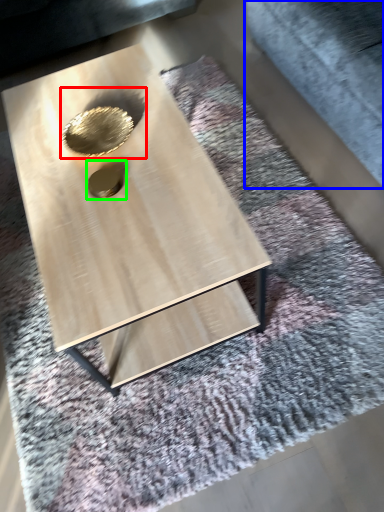
Question: Which object is the closest to the hole (highlighted by a red box)? Choose among these: gray (highlighted by a blue box) or hole (highlighted by a green box).

Choices:
 (A) gray
 (B) hole

Answer: (B)